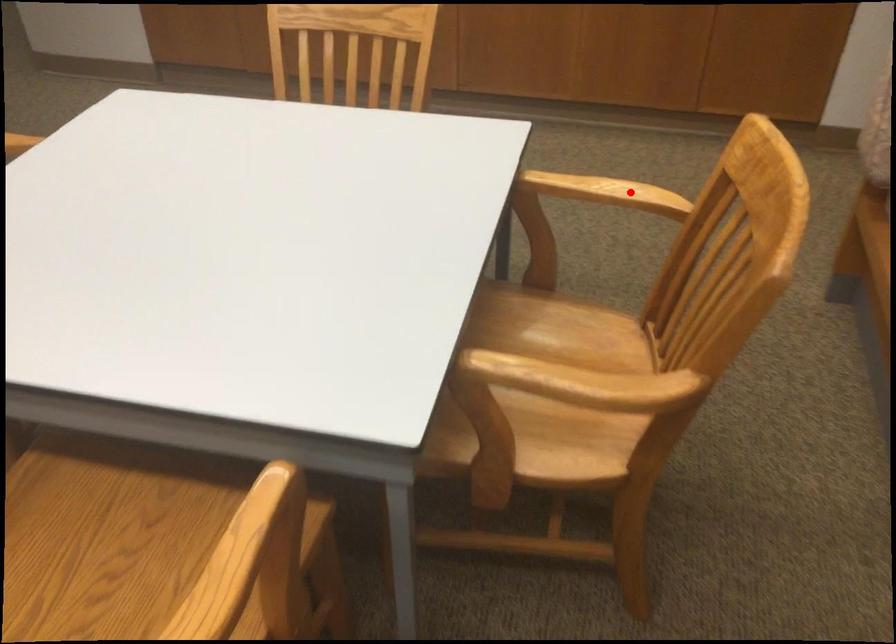
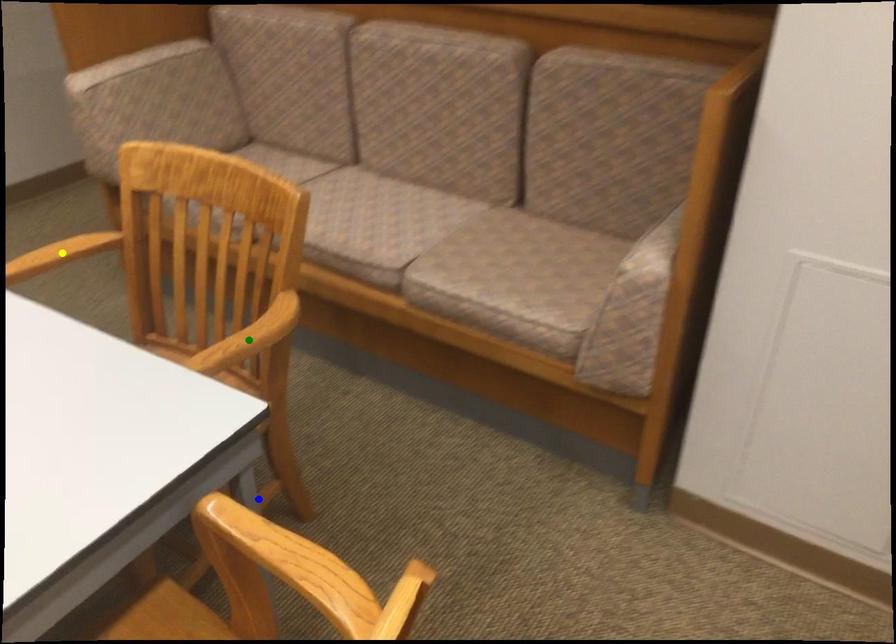
Question: I am providing you with two images of the same scene from different viewpoints. A red point is marked on the first image. You are given multiple points on the second image. Which point in image 2 is actually the same real-world point as the red point in image 1?

Choices:
 (A) yellow point
 (B) green point
 (C) blue point

Answer: (A)